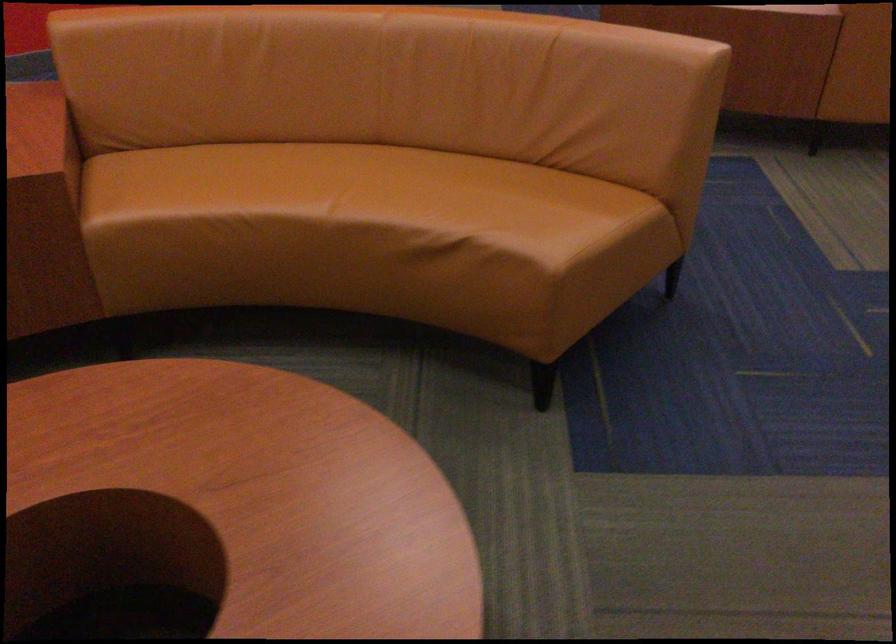
Find the location of a particular element. orange sofa sitting surface is located at coordinates (359, 189).